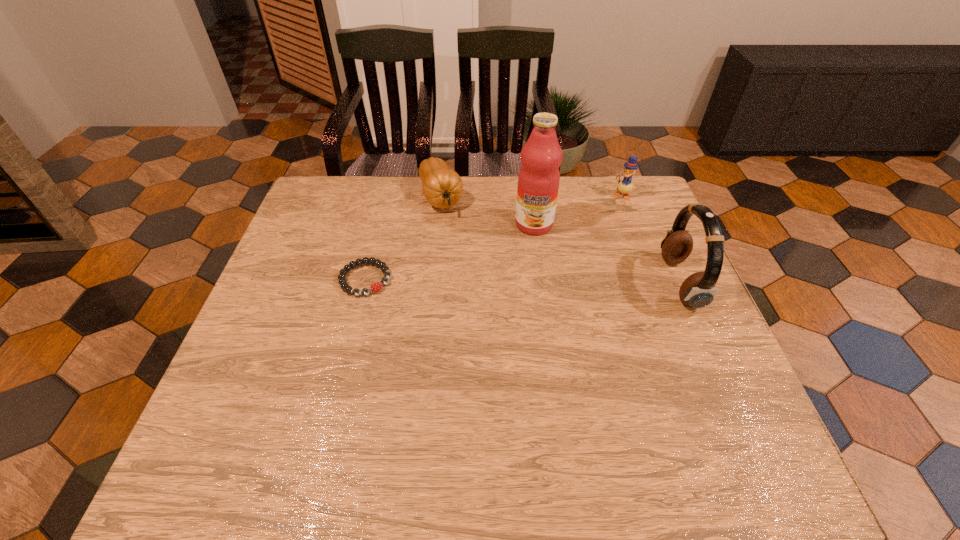
Locate an element on the screen. bracelet is located at coordinates (375, 287).

Identify the location of the shortest object. (375, 287).

In order to click on headset in this screenshot , I will do `click(698, 290)`.

This screenshot has height=540, width=960. Identify the location of the third object from left to right. (538, 181).

At what (x,y) coordinates should I click in order to perform the action: click on fruit juice. Please return your answer as a coordinate pair (x, y). Looking at the image, I should click on (538, 181).

This screenshot has width=960, height=540. I want to click on duckling, so click(x=625, y=186).

Where is `gourd`? This screenshot has height=540, width=960. gourd is located at coordinates (442, 187).

This screenshot has height=540, width=960. In order to click on vacant space situated on the right of the bracelet in this screenshot , I will do `click(459, 279)`.

Locate an element on the screen. free space located on the label of the tallest object is located at coordinates (527, 251).

The height and width of the screenshot is (540, 960). I want to click on vacant space situated on the label of the tallest object, so pyautogui.click(x=510, y=320).